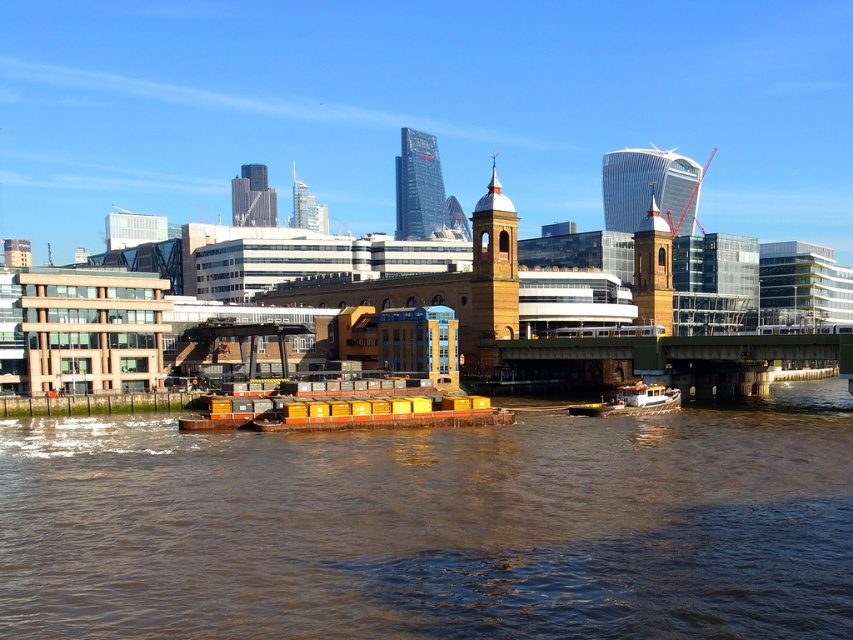
Based on the photo, does concrete bridge at center come behind yellow matte container ship at center?

Yes, concrete bridge at center is further from the viewer.

Between point (664, 372) and point (402, 396), which one is positioned in front?

Point (402, 396) is more forward.

This screenshot has height=640, width=853. What are the coordinates of `concrete bridge at center` in the screenshot? It's located at (675, 358).

Is point (596, 548) positioned in front of point (645, 348)?

Yes.

Is brown muddy water at center further to camera compared to concrete bridge at center?

No.

Describe the element at coordinates (434, 525) in the screenshot. I see `brown muddy water at center` at that location.

At what (x,y) coordinates should I click in order to perform the action: click on brown muddy water at center. Please return your answer as a coordinate pair (x, y). The width and height of the screenshot is (853, 640). Looking at the image, I should click on (434, 525).

Measure the distance between brown muddy water at center and camera.

brown muddy water at center and camera are 30.03 meters apart from each other.

Who is taller, brown muddy water at center or yellow matte container ship at center?

Standing taller between the two is yellow matte container ship at center.

Who is more forward, (340,493) or (405,388)?

Point (340,493)

At what (x,y) coordinates should I click in order to perform the action: click on brown muddy water at center. Please return your answer as a coordinate pair (x, y). Image resolution: width=853 pixels, height=640 pixels. Looking at the image, I should click on (434, 525).